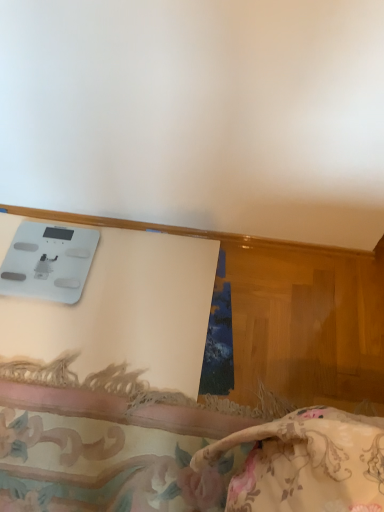
Question: Is white wood trim at upper center located outside white glossy scale at upper left?

Choices:
 (A) no
 (B) yes

Answer: (B)

Question: Would you say white wood trim at upper center contains white glossy scale at upper left?

Choices:
 (A) yes
 (B) no

Answer: (B)

Question: Does white wood trim at upper center have a greater width compared to white glossy scale at upper left?

Choices:
 (A) no
 (B) yes

Answer: (A)

Question: Is white wood trim at upper center smaller than white glossy scale at upper left?

Choices:
 (A) no
 (B) yes

Answer: (B)

Question: Is white wood trim at upper center positioned with its back to white glossy scale at upper left?

Choices:
 (A) yes
 (B) no

Answer: (A)

Question: Considering the relative positions of white wood trim at upper center and white glossy scale at upper left in the image provided, is white wood trim at upper center to the left of white glossy scale at upper left from the viewer's perspective?

Choices:
 (A) yes
 (B) no

Answer: (B)

Question: Is the position of white wood trim at upper center more distant than that of floral fabric cushion at lower center?

Choices:
 (A) yes
 (B) no

Answer: (A)

Question: From the image's perspective, is white wood trim at upper center on top of floral fabric cushion at lower center?

Choices:
 (A) no
 (B) yes

Answer: (B)

Question: From a real-world perspective, is white wood trim at upper center on floral fabric cushion at lower center?

Choices:
 (A) no
 (B) yes

Answer: (B)

Question: Does white wood trim at upper center have a lesser width compared to floral fabric cushion at lower center?

Choices:
 (A) no
 (B) yes

Answer: (B)

Question: Is white wood trim at upper center positioned far away from floral fabric cushion at lower center?

Choices:
 (A) no
 (B) yes

Answer: (A)

Question: Can you confirm if white wood trim at upper center is wider than floral fabric cushion at lower center?

Choices:
 (A) no
 (B) yes

Answer: (A)

Question: Is floral fabric cushion at lower center not within white wood trim at upper center?

Choices:
 (A) yes
 (B) no

Answer: (A)